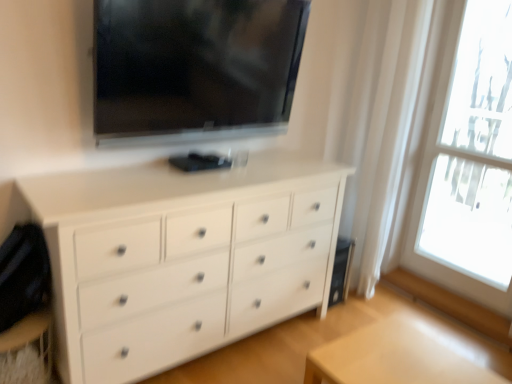
Question: From the image's perspective, is transparent glass window at right beneath white matte chest of drawers at center?

Choices:
 (A) yes
 (B) no

Answer: (B)

Question: From a real-world perspective, does transparent glass window at right stand above white matte chest of drawers at center?

Choices:
 (A) no
 (B) yes

Answer: (B)

Question: Is transparent glass window at right to the left of white matte chest of drawers at center from the viewer's perspective?

Choices:
 (A) yes
 (B) no

Answer: (B)

Question: Is transparent glass window at right positioned far away from white matte chest of drawers at center?

Choices:
 (A) yes
 (B) no

Answer: (A)

Question: Is transparent glass window at right facing towards white matte chest of drawers at center?

Choices:
 (A) no
 (B) yes

Answer: (A)

Question: Would you say black glossy tv at upper center is inside or outside light wood table at lower right?

Choices:
 (A) outside
 (B) inside

Answer: (A)

Question: Does point (279, 33) appear closer or farther from the camera than point (403, 359)?

Choices:
 (A) closer
 (B) farther

Answer: (B)

Question: Visually, is black glossy tv at upper center positioned to the left or to the right of light wood table at lower right?

Choices:
 (A) right
 (B) left

Answer: (B)

Question: Is black glossy tv at upper center in front of or behind light wood table at lower right in the image?

Choices:
 (A) front
 (B) behind

Answer: (B)

Question: Does point 456,26 appear closer or farther from the camera than point 284,261?

Choices:
 (A) closer
 (B) farther

Answer: (B)

Question: From the image's perspective, is transparent glass window at right located above or below white matte chest of drawers at center?

Choices:
 (A) above
 (B) below

Answer: (A)

Question: From a real-world perspective, relative to white matte chest of drawers at center, is transparent glass window at right vertically above or below?

Choices:
 (A) above
 (B) below

Answer: (A)

Question: Is transparent glass window at right inside or outside of white matte chest of drawers at center?

Choices:
 (A) inside
 (B) outside

Answer: (B)

Question: Is white matte chest of drawers at center bigger or smaller than black glossy tv at upper center?

Choices:
 (A) big
 (B) small

Answer: (A)

Question: Which is correct: white matte chest of drawers at center is inside black glossy tv at upper center, or outside of it?

Choices:
 (A) inside
 (B) outside

Answer: (B)